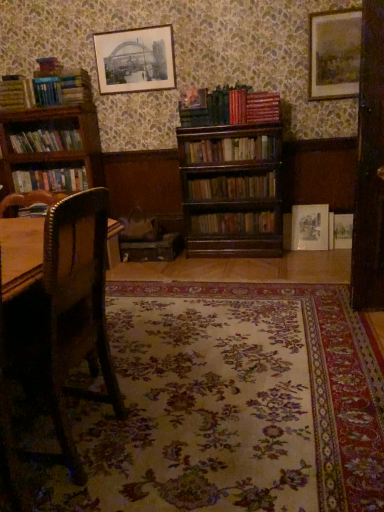
Question: Should I look upward or downward to see floral carpet at center?

Choices:
 (A) up
 (B) down

Answer: (B)

Question: Is wooden bookshelf at center, which ranks as the fourth book in bottom-to-top order, not inside hardcover books at left, arranged as the third book when ordered from the bottom?

Choices:
 (A) no
 (B) yes

Answer: (B)

Question: Is hardcover books at left, arranged as the third book when ordered from the bottom, completely or partially inside wooden bookshelf at center, which ranks as the fourth book in bottom-to-top order?

Choices:
 (A) no
 (B) yes

Answer: (A)

Question: Would you consider wooden bookshelf at center, which ranks as the fourth book in bottom-to-top order, to be distant from hardcover books at left, arranged as the third book when ordered from the bottom?

Choices:
 (A) no
 (B) yes

Answer: (B)

Question: Can you confirm if wooden bookshelf at center, which ranks as the fourth book in bottom-to-top order, is smaller than hardcover books at left, arranged as the third book when ordered from the bottom?

Choices:
 (A) no
 (B) yes

Answer: (B)

Question: Is wooden bookshelf at center, which ranks as the fourth book in bottom-to-top order, next to hardcover books at left, the 5th book from the top, and touching it?

Choices:
 (A) yes
 (B) no

Answer: (B)

Question: Does wooden bookshelf at center, which ranks as the fourth book in bottom-to-top order, have a lesser width compared to hardcover books at left, the 5th book from the top?

Choices:
 (A) no
 (B) yes

Answer: (A)

Question: Can you confirm if matte paper picture frame at upper center, arranged as the first picture frame when viewed from the left, is bigger than wooden bookshelf at center, which is the 1th book in bottom-to-top order?

Choices:
 (A) no
 (B) yes

Answer: (B)

Question: From a real-world perspective, is matte paper picture frame at upper center, which is counted as the 1th picture frame, starting from the top, beneath wooden bookshelf at center, marked as the seventh book in a top-to-bottom arrangement?

Choices:
 (A) yes
 (B) no

Answer: (B)

Question: From the image's perspective, is matte paper picture frame at upper center, which is counted as the 1th picture frame, starting from the top, located beneath wooden bookshelf at center, which is the 1th book in bottom-to-top order?

Choices:
 (A) yes
 (B) no

Answer: (B)

Question: Is matte paper picture frame at upper center, which is the 3th picture frame in bottom-to-top order, far away from wooden bookshelf at center, marked as the seventh book in a top-to-bottom arrangement?

Choices:
 (A) yes
 (B) no

Answer: (A)

Question: Is matte paper picture frame at upper center, which is the 3th picture frame in bottom-to-top order, positioned behind wooden bookshelf at center, which is the 1th book in bottom-to-top order?

Choices:
 (A) yes
 (B) no

Answer: (B)

Question: Would you say wooden bookshelf at center, which is the 1th book in bottom-to-top order, is part of matte paper picture frame at upper center, placed as the third picture frame when sorted from right to left,'s contents?

Choices:
 (A) no
 (B) yes

Answer: (A)

Question: Is hardcover books at left, arranged as the third book when ordered from the bottom, facing towards matte paper picture frame at upper right, which is counted as the 2th picture frame, starting from the left?

Choices:
 (A) yes
 (B) no

Answer: (B)